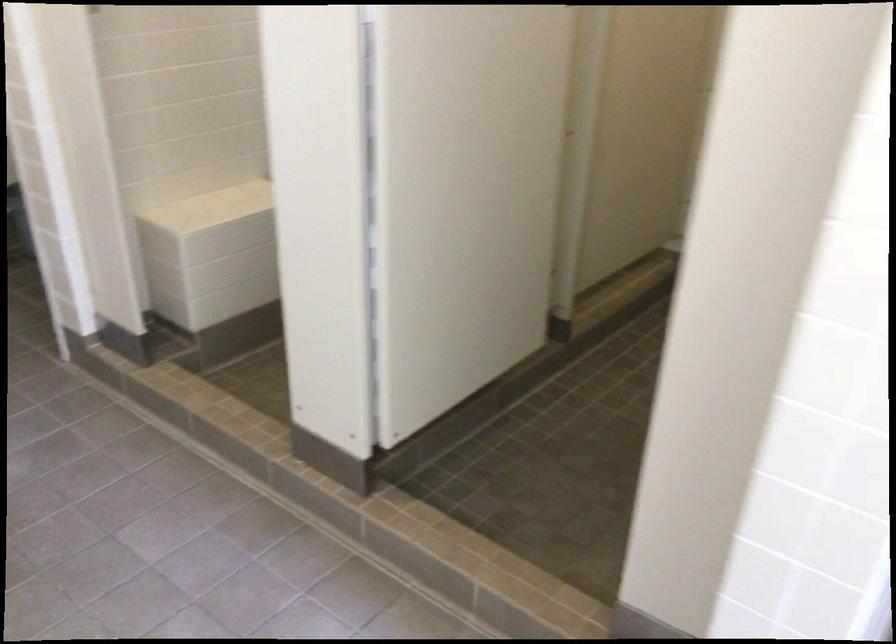
First-person continuous shooting, in which direction is the camera rotating?

The rotation direction of the camera is right-down.